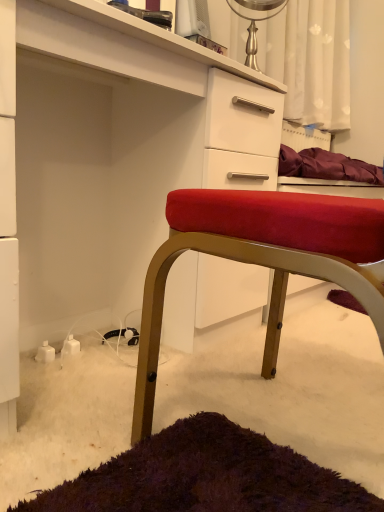
Image resolution: width=384 pixels, height=512 pixels. I want to click on matte white cabinet at center, so click(x=117, y=154).

Image resolution: width=384 pixels, height=512 pixels. What do you see at coordinates (117, 154) in the screenshot?
I see `matte white cabinet at center` at bounding box center [117, 154].

At what (x,y) coordinates should I click in order to perform the action: click on matte white cabinet at center. Please return your answer as a coordinate pair (x, y). This screenshot has height=512, width=384. Looking at the image, I should click on (117, 154).